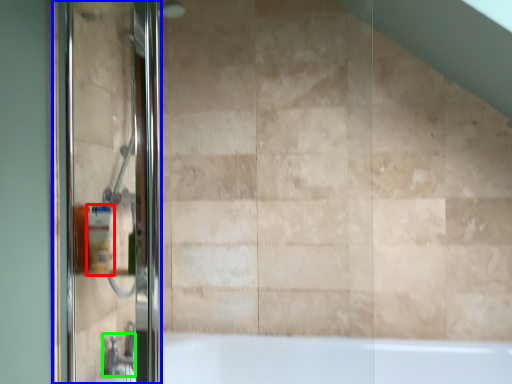
Question: Which object is positioned farthest from toiletry (highlighted by a red box)? Select from screen door (highlighted by a blue box) and faucet (highlighted by a green box).

Choices:
 (A) screen door
 (B) faucet

Answer: (B)